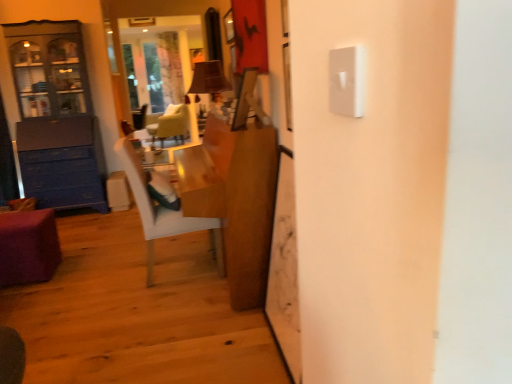
Identify the location of vacant area that lies between white glossy chair at center, the first chair positioned from the right, and purple fabric ottoman at lower left. (90, 269).